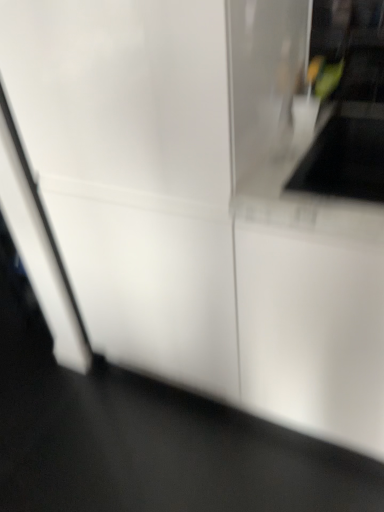
Question: Should I look upward or downward to see black matte floor at lower left?

Choices:
 (A) up
 (B) down

Answer: (B)